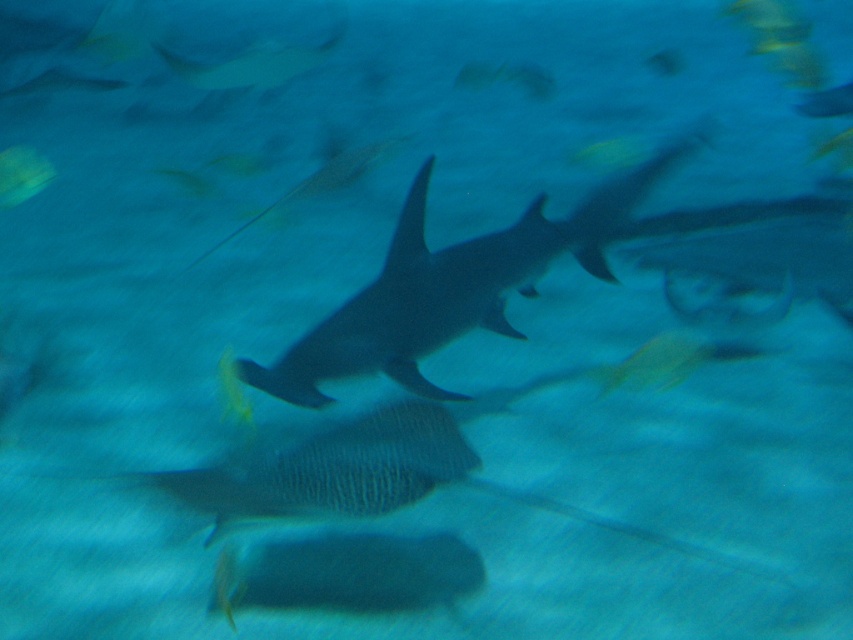
Question: Which object is farther from the camera taking this photo?

Choices:
 (A) translucent yellow fish at upper left
 (B) gray matte shark at center

Answer: (A)

Question: Does gray matte shark at center have a greater width compared to translucent yellow fish at upper left?

Choices:
 (A) no
 (B) yes

Answer: (B)

Question: Among these points, which one is nearest to the camera?

Choices:
 (A) coord(524,259)
 (B) coord(16,186)

Answer: (A)

Question: Which of the following is the farthest from the observer?

Choices:
 (A) (35, 182)
 (B) (405, 324)

Answer: (A)

Question: Can you confirm if gray matte shark at center is positioned to the left of translucent yellow fish at upper left?

Choices:
 (A) yes
 (B) no

Answer: (B)

Question: Does gray matte shark at center lie behind translucent yellow fish at upper left?

Choices:
 (A) yes
 (B) no

Answer: (B)